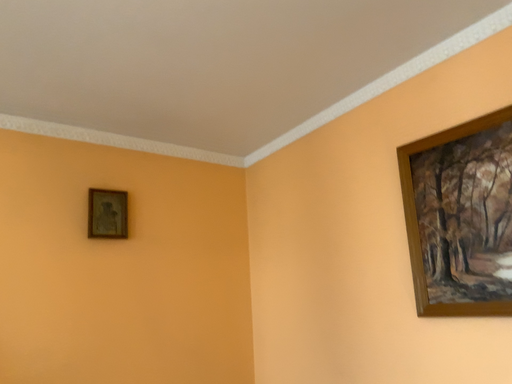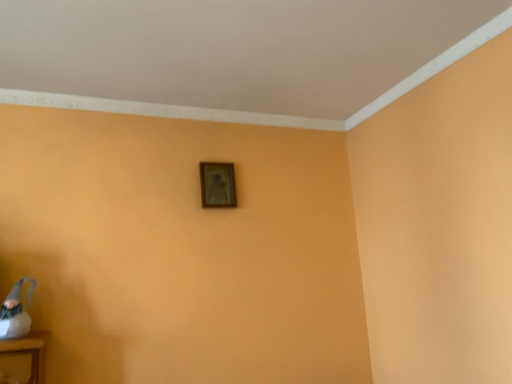
Question: How did the camera likely rotate when shooting the video?

Choices:
 (A) rotated left
 (B) rotated right

Answer: (A)